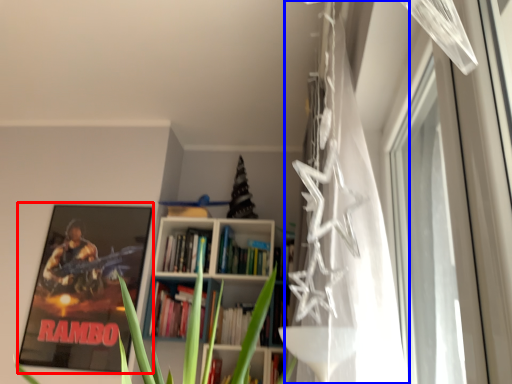
Question: Among these objects, which one is nearest to the camera, picture frame (highlighted by a red box) or curtain (highlighted by a blue box)?

Choices:
 (A) picture frame
 (B) curtain

Answer: (B)